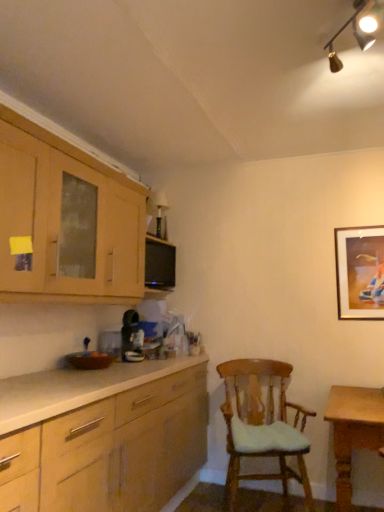
Question: Considering the relative positions of gold-framed picture at upper right and wooden table at lower right in the image provided, is gold-framed picture at upper right to the left or to the right of wooden table at lower right?

Choices:
 (A) right
 (B) left

Answer: (A)

Question: From a real-world perspective, is gold-framed picture at upper right positioned above or below wooden table at lower right?

Choices:
 (A) above
 (B) below

Answer: (A)

Question: Considering the real-world distances, which object is farthest from the gold metallic track lighting at upper right?

Choices:
 (A) wooden table at lower right
 (B) wooden chair with cushion at center
 (C) wooden cabinet at upper left
 (D) gold-framed picture at upper right

Answer: (B)

Question: Which of these objects is positioned closest to the gold metallic track lighting at upper right?

Choices:
 (A) wooden chair with cushion at center
 (B) wooden table at lower right
 (C) gold-framed picture at upper right
 (D) wooden cabinet at upper left

Answer: (C)